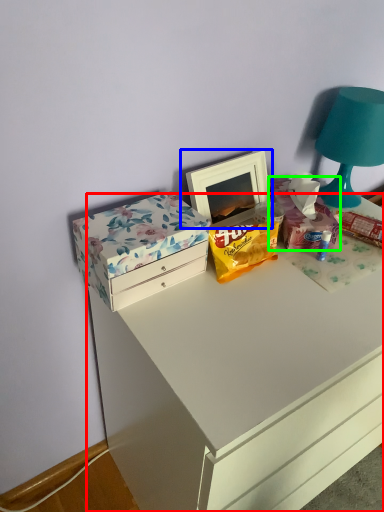
Question: Based on their relative distances, which object is nearer to chest of drawers (highlighted by a red box)? Choose from picture frame (highlighted by a blue box) and storage box (highlighted by a green box).

Choices:
 (A) picture frame
 (B) storage box

Answer: (B)